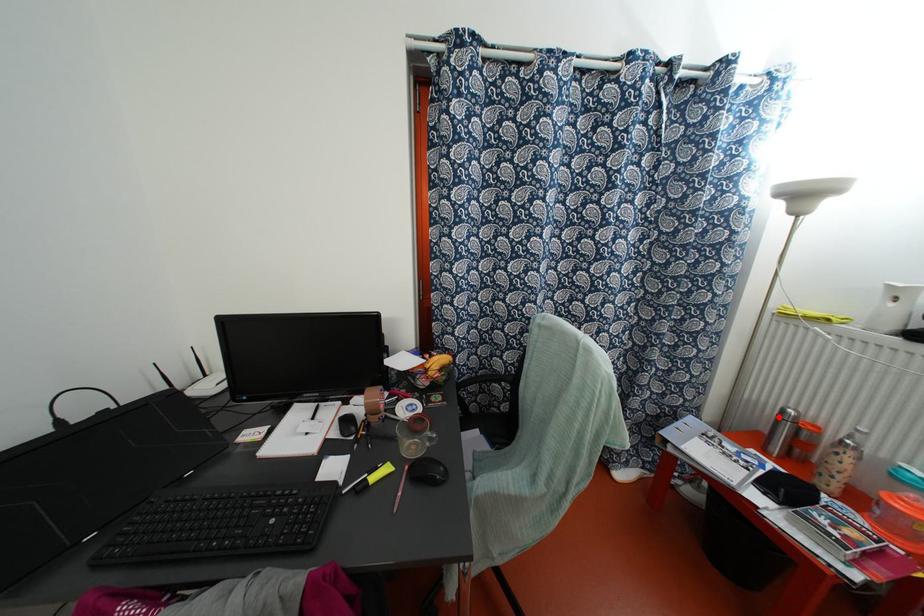
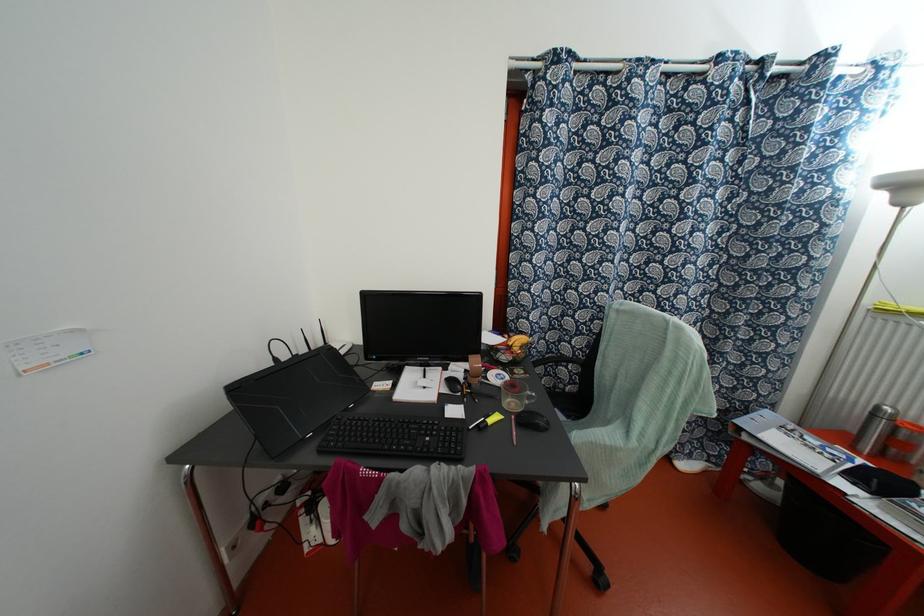
Find the pixel in the second image that matches the highlighted location in the first image.

(872, 415)